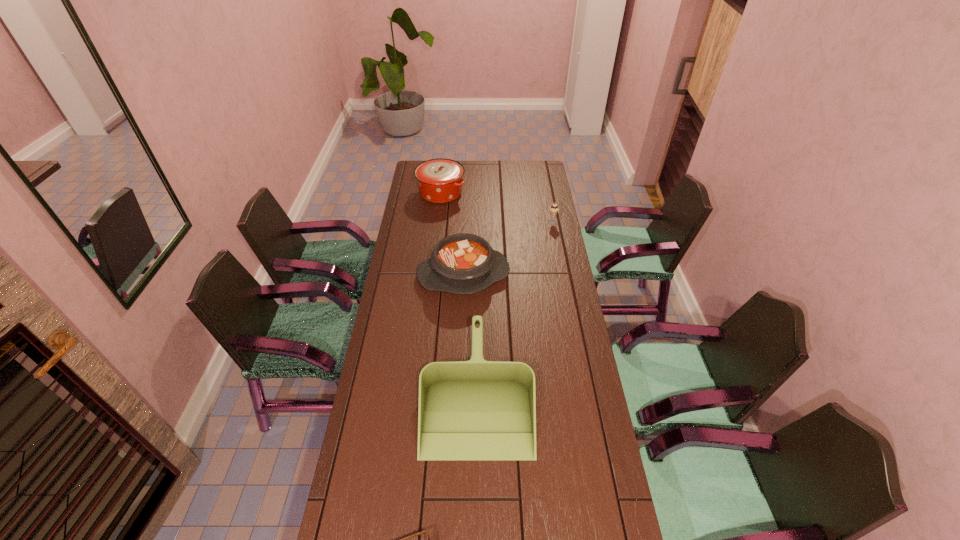
This screenshot has width=960, height=540. Identify the location of the farthest object. (440, 180).

Locate an element on the screen. This screenshot has height=540, width=960. the tallest object is located at coordinates (440, 180).

Where is `the nearer casserole`? the nearer casserole is located at coordinates (463, 263).

The width and height of the screenshot is (960, 540). In order to click on the shorter casserole in this screenshot , I will do `click(463, 263)`.

At what (x,y) coordinates should I click in order to perform the action: click on the second farthest object. Please return your answer as a coordinate pair (x, y). This screenshot has height=540, width=960. Looking at the image, I should click on (553, 209).

This screenshot has width=960, height=540. In order to click on the rightmost object in this screenshot , I will do `click(553, 209)`.

At what (x,y) coordinates should I click in order to perform the action: click on dustpan. Please return your answer as a coordinate pair (x, y). Looking at the image, I should click on (468, 410).

At what (x,y) coordinates should I click in order to perform the action: click on vacant space located on the right of the taller casserole. Please return your answer as a coordinate pair (x, y). Looking at the image, I should click on (514, 193).

This screenshot has width=960, height=540. Find the location of `free space located on the back of the nearer casserole`. free space located on the back of the nearer casserole is located at coordinates (466, 221).

Identify the location of vacant area situated 0.240m on the front of the rightmost object. (560, 259).